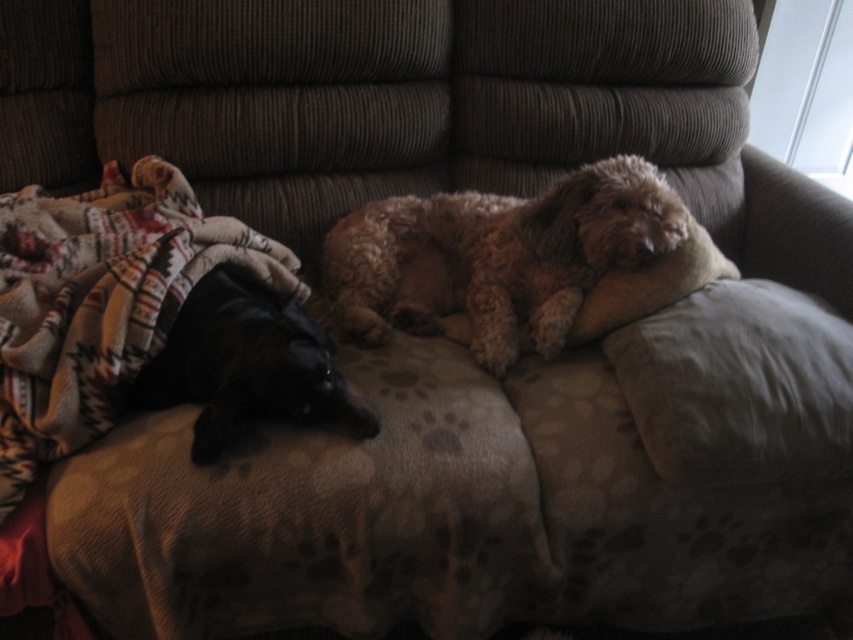
You are a dog owner who wants to place a new toy between the gray fabric pillow at right and the black fur dog at left on the couch. Based on their heights, which one is taller and should the toy be placed closer to the taller object to avoid blocking the view?

The gray fabric pillow at right is taller than the black fur dog at left. To avoid blocking the view, the toy should be placed closer to the taller object, which is the gray fabric pillow at right.

You are a delivery robot with a package that is 24 inches long. You need to place it on the couch between the gray fabric pillow at right and the black fur dog at left. Is there enough space?

The distance between the gray fabric pillow at right and the black fur dog at left is 22.82 inches. Since the package is 24 inches long, it is slightly longer than the available space. Therefore, the package cannot fit between them.

You are standing in front of the couch with two dogs. You want to place a small gift exactly halfway between point (x=83, y=301) and point (x=706, y=429). Considering the couch and the dogs, will the gift be closer to the front or the back of the couch?

The gift placed halfway between point (x=83, y=301) and point (x=706, y=429) will be closer to the front of the couch because point (x=83, y=301) is closer to the viewer than point (x=706, y=429).